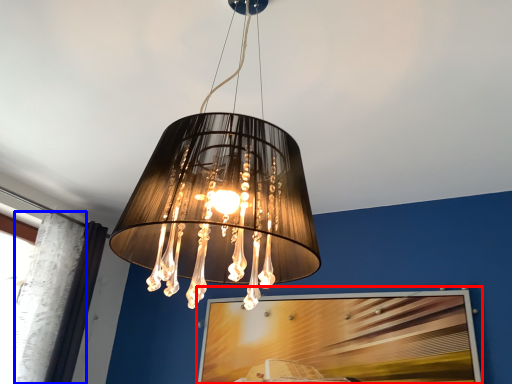
Question: Which of the following is the farthest to the observer, picture frame (highlighted by a red box) or curtain (highlighted by a blue box)?

Choices:
 (A) picture frame
 (B) curtain

Answer: (B)